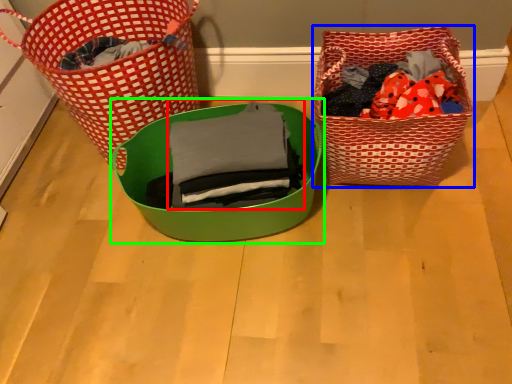
Question: Based on their relative distances, which object is nearer to clothing (highlighted by a red box)? Choose from picnic basket (highlighted by a blue box) and gift basket (highlighted by a green box).

Choices:
 (A) picnic basket
 (B) gift basket

Answer: (B)